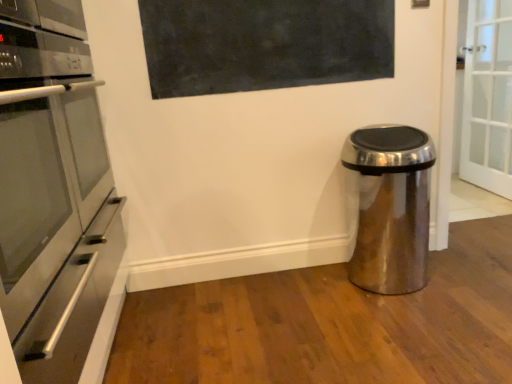
Image resolution: width=512 pixels, height=384 pixels. What do you see at coordinates (53, 191) in the screenshot?
I see `stainless steel oven at left` at bounding box center [53, 191].

The width and height of the screenshot is (512, 384). What are the coordinates of `matte black board at upper center` in the screenshot? It's located at (264, 44).

Between stainless steel oven at left and matte black board at upper center, which one has less height?

matte black board at upper center.

Is stainless steel oven at left aimed at matte black board at upper center?

No, stainless steel oven at left does not turn towards matte black board at upper center.

Which is nearer, (37, 369) or (182, 3)?

The point (37, 369) is in front.

How many degrees apart are the facing directions of stainless steel oven at left and matte black board at upper center?

They differ by 91.1 degrees in their facing directions.

Measure the distance between satin metallic trash can at lower right and stainless steel oven at left.

They are 1.24 meters apart.

Considering the sizes of satin metallic trash can at lower right and stainless steel oven at left in the image, is satin metallic trash can at lower right taller or shorter than stainless steel oven at left?

Clearly, satin metallic trash can at lower right is taller compared to stainless steel oven at left.

Is satin metallic trash can at lower right surrounding stainless steel oven at left?

That's incorrect, stainless steel oven at left is not inside satin metallic trash can at lower right.

From a real-world perspective, relative to stainless steel oven at left, is satin metallic trash can at lower right vertically above or below?

From a real-world perspective, satin metallic trash can at lower right is physically below stainless steel oven at left.

From a real-world perspective, is satin metallic trash can at lower right over matte black board at upper center?

No.

Considering the relative positions of satin metallic trash can at lower right and matte black board at upper center in the image provided, is satin metallic trash can at lower right behind matte black board at upper center?

No, satin metallic trash can at lower right is closer to the viewer.

Would you say satin metallic trash can at lower right is a long distance from matte black board at upper center?

No.

Consider the image. From the image's perspective, would you say satin metallic trash can at lower right is shown under matte black board at upper center?

Correct, satin metallic trash can at lower right appears lower than matte black board at upper center in the image.

Between matte black board at upper center and satin metallic trash can at lower right, which one appears on the right side from the viewer's perspective?

Positioned to the right is satin metallic trash can at lower right.

From a real-world perspective, which object stands above the other?

In real-world perspective, matte black board at upper center is above.

From the image's perspective, between matte black board at upper center and satin metallic trash can at lower right, who is located below?

satin metallic trash can at lower right.

Is matte black board at upper center aimed at satin metallic trash can at lower right?

No, matte black board at upper center does not turn towards satin metallic trash can at lower right.

Is stainless steel oven at left facing away from satin metallic trash can at lower right?

No.

From a real-world perspective, which is physically below, stainless steel oven at left or satin metallic trash can at lower right?

satin metallic trash can at lower right.

Can satin metallic trash can at lower right be found inside stainless steel oven at left?

No, satin metallic trash can at lower right is not surrounded by stainless steel oven at left.

Consider the image. Is matte black board at upper center with stainless steel oven at left?

matte black board at upper center and stainless steel oven at left are clearly separated.

Based on their positions, is matte black board at upper center located to the left or right of stainless steel oven at left?

Based on their positions, matte black board at upper center is located to the right of stainless steel oven at left.

Can you tell me how much matte black board at upper center and stainless steel oven at left differ in facing direction?

They differ by 91.1 degrees in their facing directions.

Identify the location of home appliance in front of the matte black board at upper center. Image resolution: width=512 pixels, height=384 pixels. (53, 191).

Find the location of a particular element. The width and height of the screenshot is (512, 384). waste container above the stainless steel oven at left (from the image's perspective) is located at coordinates (391, 207).

Estimate the real-world distances between objects in this image. Which object is closer to stainless steel oven at left, satin metallic trash can at lower right or matte black board at upper center?

matte black board at upper center is closer to stainless steel oven at left.

Based on their spatial positions, is matte black board at upper center or stainless steel oven at left further from satin metallic trash can at lower right?

The object further to satin metallic trash can at lower right is stainless steel oven at left.

Which object lies further to the anchor point matte black board at upper center, stainless steel oven at left or satin metallic trash can at lower right?

Based on the image, stainless steel oven at left appears to be further to matte black board at upper center.

Estimate the real-world distances between objects in this image. Which object is further from stainless steel oven at left, matte black board at upper center or satin metallic trash can at lower right?

satin metallic trash can at lower right is positioned further to the anchor stainless steel oven at left.

From the image, which object appears to be nearer to matte black board at upper center, satin metallic trash can at lower right or stainless steel oven at left?

Among the two, satin metallic trash can at lower right is located nearer to matte black board at upper center.

Which object lies nearer to the anchor point satin metallic trash can at lower right, stainless steel oven at left or matte black board at upper center?

matte black board at upper center is positioned closer to the anchor satin metallic trash can at lower right.

Where is `waste container between stainless steel oven at left and matte black board at upper center along the z-axis`? waste container between stainless steel oven at left and matte black board at upper center along the z-axis is located at coordinates (391, 207).